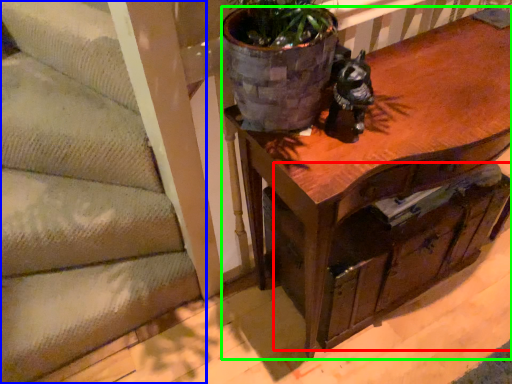
Question: Which object is the farthest from drawer (highlighted by a red box)? Choose among these: stairwell (highlighted by a blue box) or table (highlighted by a green box).

Choices:
 (A) stairwell
 (B) table

Answer: (A)